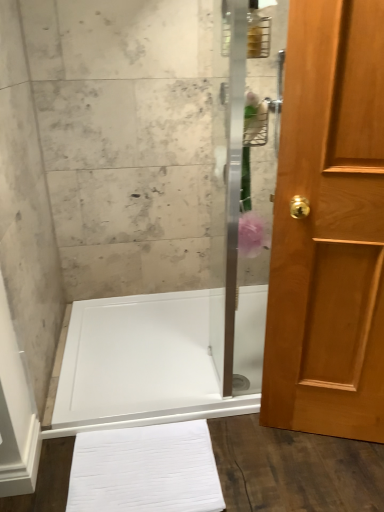
Identify the location of white cotton bath towel at lower center. The width and height of the screenshot is (384, 512). (145, 470).

Identify the location of light brown wood door at right. (329, 227).

Which is behind, white cotton bath towel at lower center or white glossy shower tray at center?

white glossy shower tray at center is behind.

Would you consider white cotton bath towel at lower center to be distant from white glossy shower tray at center?

white cotton bath towel at lower center is near white glossy shower tray at center, not far away.

Which is more to the left, white cotton bath towel at lower center or white glossy shower tray at center?

white cotton bath towel at lower center.

Consider the image. From a real-world perspective, which is physically above, white cotton bath towel at lower center or white glossy shower tray at center?

From a 3D spatial view, white glossy shower tray at center is above.

Considering the positions of objects light brown wood door at right and clear glass shower door at center in the image provided, who is more to the left, light brown wood door at right or clear glass shower door at center?

From the viewer's perspective, clear glass shower door at center appears more on the left side.

Does light brown wood door at right touch clear glass shower door at center?

light brown wood door at right is not next to clear glass shower door at center, and they're not touching.

Is point (357, 140) closer or farther from the camera than point (237, 147)?

Point (357, 140) is closer to the camera than point (237, 147).

Is clear glass shower door at center looking in the opposite direction of light brown wood door at right?

No.

From a real-world perspective, which object stands above the other?

In real-world perspective, clear glass shower door at center is above.

Which of these two, clear glass shower door at center or light brown wood door at right, is thinner?

clear glass shower door at center.

Identify the location of door on the right of clear glass shower door at center. (329, 227).

Can you confirm if white cotton bath towel at lower center is bigger than light brown wood door at right?

No.

From a real-world perspective, is white cotton bath towel at lower center located higher than light brown wood door at right?

No, from a real-world perspective, white cotton bath towel at lower center is not on top of light brown wood door at right.

Considering the points (151, 464) and (364, 214), which point is in front, point (151, 464) or point (364, 214)?

The point (364, 214) is in front.

Which is more to the right, light brown wood door at right or white glossy shower tray at center?

light brown wood door at right is more to the right.

Which of these two, light brown wood door at right or white glossy shower tray at center, stands shorter?

With less height is white glossy shower tray at center.

Which is correct: white glossy shower tray at center is inside clear glass shower door at center, or outside of it?

white glossy shower tray at center exists outside the volume of clear glass shower door at center.

Considering the positions of points (247, 362) and (259, 253), is point (247, 362) farther from camera compared to point (259, 253)?

No, it is in front of (259, 253).

From a real-world perspective, between white glossy shower tray at center and clear glass shower door at center, who is vertically higher?

clear glass shower door at center is physically above.

How much distance is there between white glossy shower tray at center and clear glass shower door at center?

white glossy shower tray at center is 12.54 inches away from clear glass shower door at center.

From the image's perspective, does white glossy shower tray at center appear lower than light brown wood door at right?

Yes.

From a real-world perspective, between white glossy shower tray at center and light brown wood door at right, who is vertically lower?

white glossy shower tray at center, from a real-world perspective.

How far apart are white glossy shower tray at center and light brown wood door at right?

white glossy shower tray at center is 27.64 inches away from light brown wood door at right.

At what (x,y) coordinates should I click in order to perform the action: click on bath that is below the light brown wood door at right (from the image's perspective). Please return your answer as a coordinate pair (x, y). The height and width of the screenshot is (512, 384). Looking at the image, I should click on (153, 360).

Locate an element on the screen. This screenshot has width=384, height=512. bath above the white cotton bath towel at lower center (from the image's perspective) is located at coordinates (153, 360).

Where is `shower door behind the light brown wood door at right`? The height and width of the screenshot is (512, 384). shower door behind the light brown wood door at right is located at coordinates (243, 197).

Considering their positions, is clear glass shower door at center positioned closer to white glossy shower tray at center than white cotton bath towel at lower center?

The object closer to white glossy shower tray at center is clear glass shower door at center.

Which object lies further to the anchor point white glossy shower tray at center, white cotton bath towel at lower center or light brown wood door at right?

Answer: light brown wood door at right lies further to white glossy shower tray at center than the other object.

Looking at the image, which one is located closer to clear glass shower door at center, white glossy shower tray at center or white cotton bath towel at lower center?

white glossy shower tray at center is positioned closer to the anchor clear glass shower door at center.

Looking at this image, estimate the real-world distances between objects in this image. Which object is closer to white cotton bath towel at lower center, white glossy shower tray at center or clear glass shower door at center?

white glossy shower tray at center.

When comparing their distances from clear glass shower door at center, does white cotton bath towel at lower center or light brown wood door at right seem closer?

Based on the image, white cotton bath towel at lower center appears to be nearer to clear glass shower door at center.

Looking at the image, which one is located further to light brown wood door at right, white cotton bath towel at lower center or white glossy shower tray at center?

Based on the image, white glossy shower tray at center appears to be further to light brown wood door at right.

When comparing their distances from white cotton bath towel at lower center, does clear glass shower door at center or light brown wood door at right seem closer?

clear glass shower door at center is positioned closer to the anchor white cotton bath towel at lower center.

When comparing their distances from clear glass shower door at center, does white cotton bath towel at lower center or white glossy shower tray at center seem further?

Based on the image, white cotton bath towel at lower center appears to be further to clear glass shower door at center.

Image resolution: width=384 pixels, height=512 pixels. I want to click on door between clear glass shower door at center and white cotton bath towel at lower center from top to bottom, so click(329, 227).

Find the location of a particular element. shower door between light brown wood door at right and white glossy shower tray at center along the z-axis is located at coordinates (243, 197).

You are a GUI agent. You are given a task and a screenshot of the screen. Output one action in this format:
    pyautogui.click(x=<x>, y=<y>)
    Task: Click on the bath between clear glass shower door at center and white cotton bath towel at lower center in the vertical direction
    This screenshot has height=512, width=384.
    Given the screenshot: What is the action you would take?
    pyautogui.click(x=153, y=360)

The height and width of the screenshot is (512, 384). In order to click on bath between light brown wood door at right and white cotton bath towel at lower center in the up-down direction in this screenshot , I will do `click(153, 360)`.